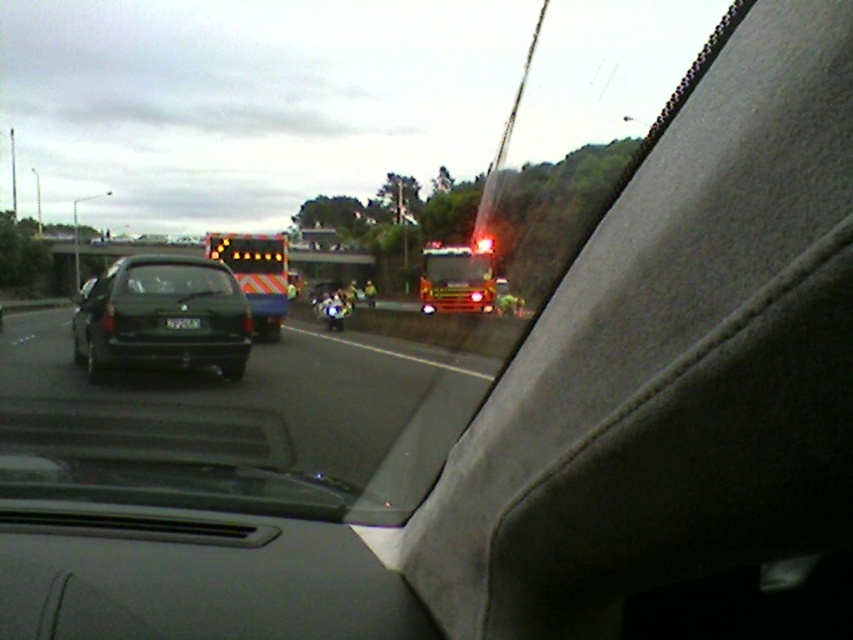
Question: Is reflective orange fire truck at center positioned before black matte windshield at center?

Choices:
 (A) no
 (B) yes

Answer: (A)

Question: Can you confirm if black glossy car at left is positioned below shiny red fire truck at center?

Choices:
 (A) no
 (B) yes

Answer: (B)

Question: Considering the real-world distances, which object is closest to the shiny red fire truck at center?

Choices:
 (A) black matte windshield at center
 (B) black plastic license plate at center

Answer: (A)

Question: Does black matte windshield at center appear on the right side of black plastic license plate at center?

Choices:
 (A) yes
 (B) no

Answer: (B)

Question: Which of the following is the farthest from the observer?

Choices:
 (A) (456, 266)
 (B) (137, 280)

Answer: (A)

Question: Which object appears closest to the camera in this image?

Choices:
 (A) reflective orange fire truck at center
 (B) black plastic license plate at center
 (C) black matte windshield at center
 (D) shiny red fire truck at center

Answer: (C)